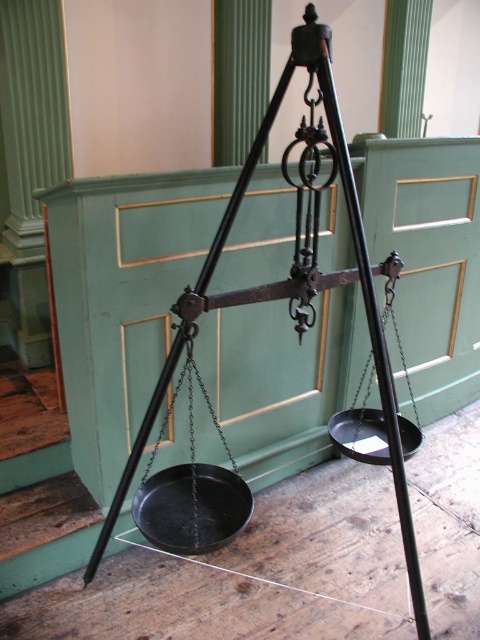
Does black matte scale at center have a lesser height compared to black metal pan at right?

Incorrect, black matte scale at center's height does not fall short of black metal pan at right's.

Is point (181, 374) positioned before point (394, 326)?

Yes, point (181, 374) is in front of point (394, 326).

Does point (197, 529) come behind point (364, 412)?

No.

At what (x,y) coordinates should I click in order to perform the action: click on black matte scale at center. Please return your answer as a coordinate pair (x, y). The image size is (480, 640). Looking at the image, I should click on (192, 492).

Which is below, black metal tripod at center or black matte scale at center?

black matte scale at center is lower down.

Between point (360, 220) and point (240, 481), which one is positioned behind?

Point (240, 481)

Find the location of a particular element. Image resolution: width=480 pixels, height=640 pixels. black metal tripod at center is located at coordinates (295, 288).

Who is more distant from viewer, (207, 253) or (367, 417)?

Positioned behind is point (367, 417).

Is point (376, 368) closer to viewer compared to point (409, 387)?

Yes, it is.

The height and width of the screenshot is (640, 480). In order to click on black metal tripod at center in this screenshot , I will do `click(295, 288)`.